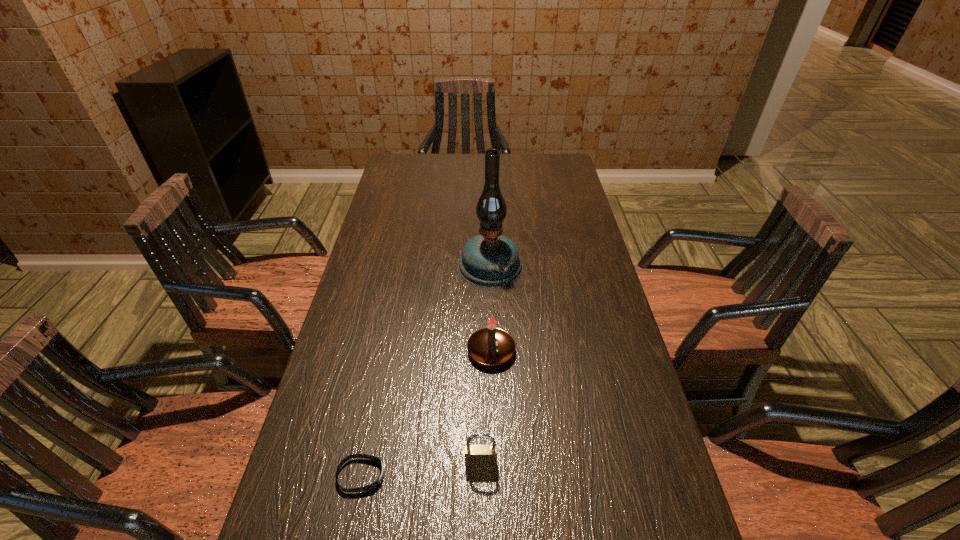
The height and width of the screenshot is (540, 960). Identify the location of vacant space that satisfies the following two spatial constraints: 1. on the front side of the candle; 2. on the display of the leftmost object. click(x=494, y=475).

Locate an element on the screen. This screenshot has width=960, height=540. free location that satisfies the following two spatial constraints: 1. on the front-facing side of the padlock; 2. on the display of the wristband is located at coordinates pos(481,475).

What are the coordinates of `blank area in the image that satisfies the following two spatial constraints: 1. on the front-facing side of the third tallest object; 2. on the display of the wristband` in the screenshot? It's located at (481, 475).